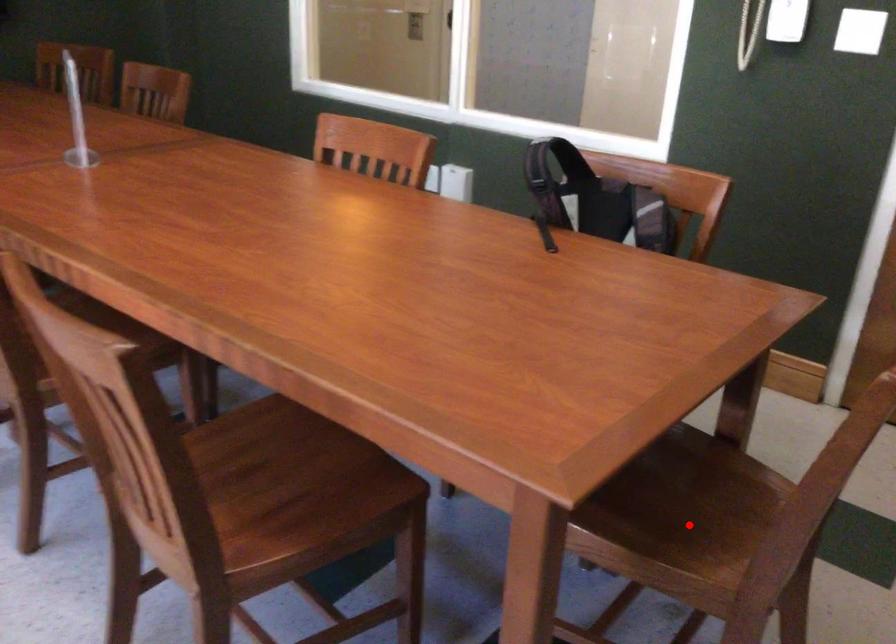
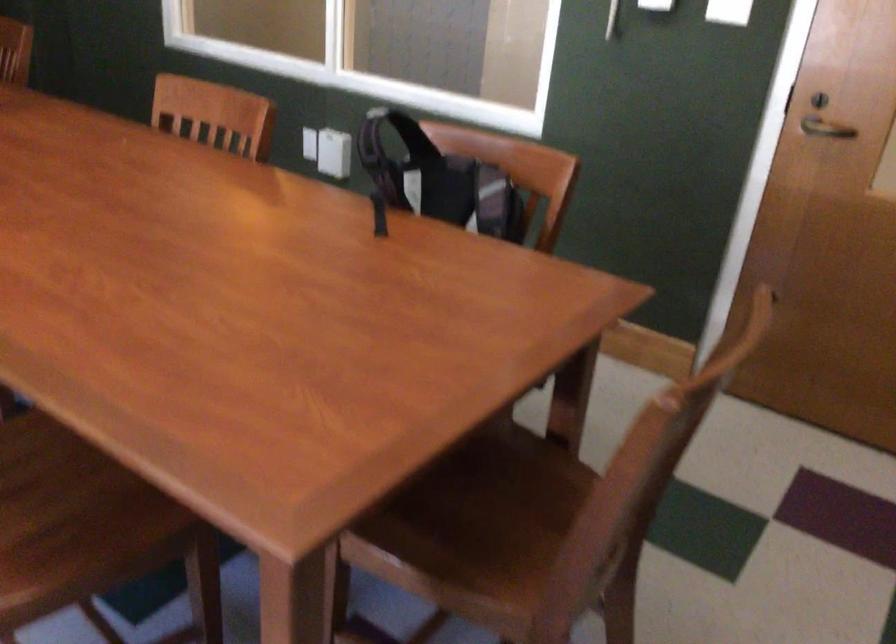
Where in the second image is the point corresponding to the highlighted location from the first image?

(495, 536)